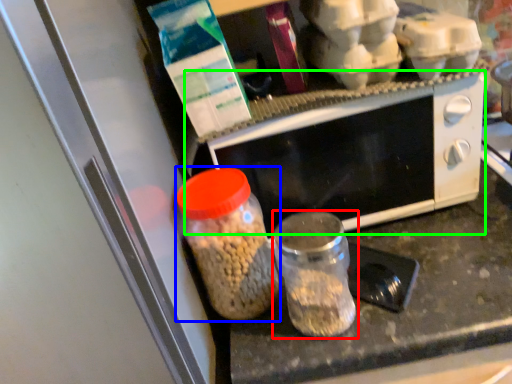
Question: Estimate the real-world distances between objects in this image. Which object is closer to bottle (highlighted by a red box), bottle (highlighted by a blue box) or microwave oven (highlighted by a green box)?

Choices:
 (A) bottle
 (B) microwave oven

Answer: (A)